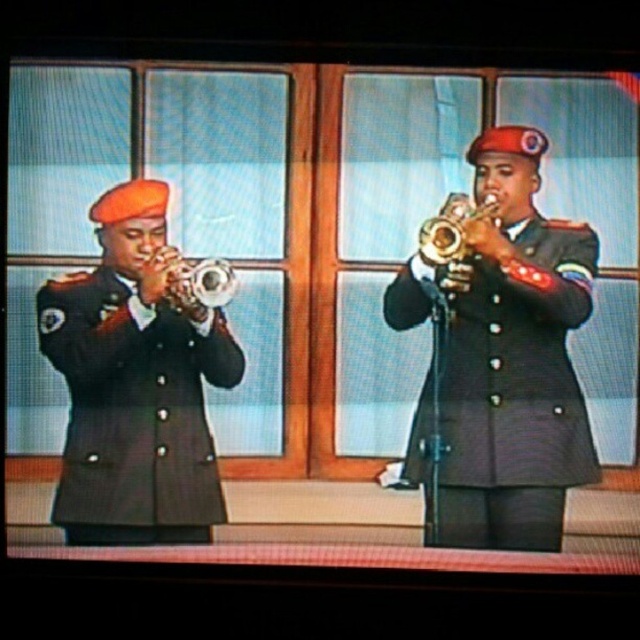
You are standing in front of the image and want to know the distance to the point marked at coordinates point (97,320). Can you tell me how far it is from where I am standing?

The point (97,320) is 3.70 meters away from the viewer.

You are a stagehand setting up for a performance. You need to place a 10 inch wide music stand between the two trumpets. Will the music stand fit between the matte black trumpet at left and the brushed metal trumpet at left?

The matte black trumpet at left and the brushed metal trumpet at left are 9.16 inches apart. Since the music stand is 10 inches wide, it will not fit between them as the space is narrower than the stand.

You are a musician who needs to choose a trumpet for a performance. The matte black trumpet at left is larger than the gold shiny trumpet at center. Which trumpet would you choose if you prefer a larger instrument?

The matte black trumpet at left is larger than the gold shiny trumpet at center, so you should choose the matte black trumpet at left for a larger instrument.